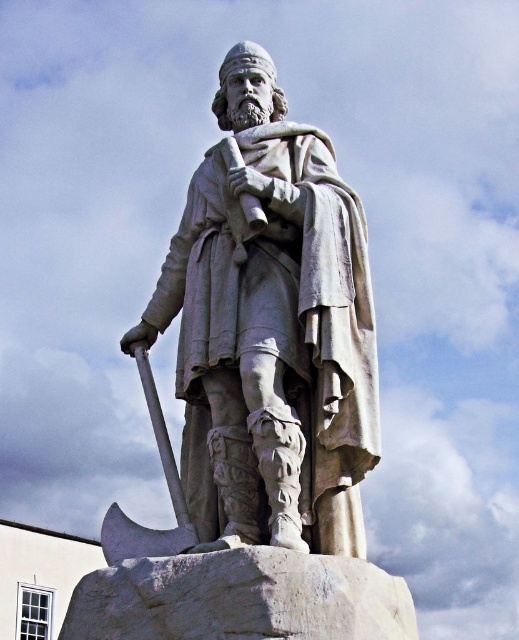
Is white stone statue at center behind polished silver axe at lower left?

No, it is not.

Does white stone statue at center have a smaller size compared to polished silver axe at lower left?

Yes, white stone statue at center is smaller than polished silver axe at lower left.

Is point (347, 314) positioned after point (170, 468)?

No, (347, 314) is closer to viewer.

Find the location of `white stone statue at center`. white stone statue at center is located at coordinates (270, 330).